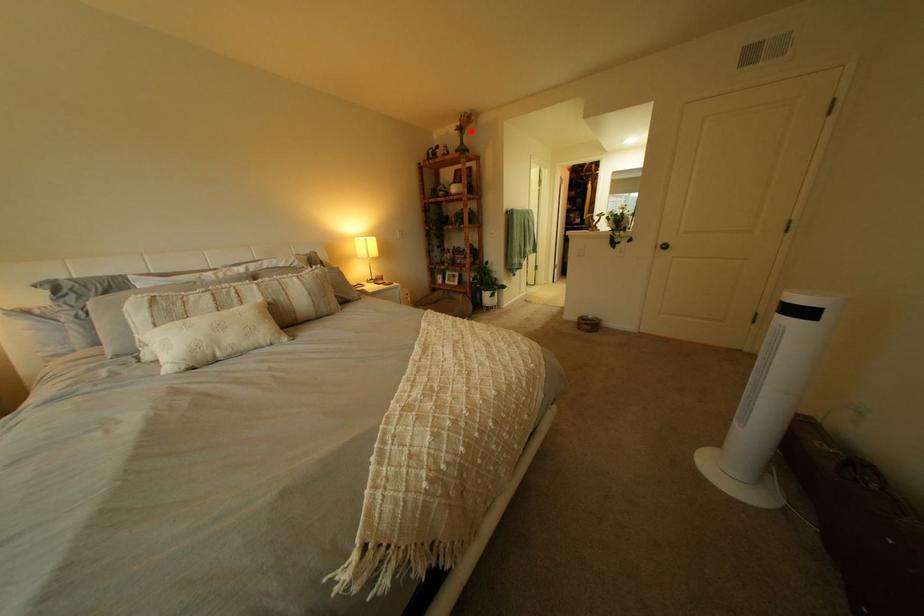
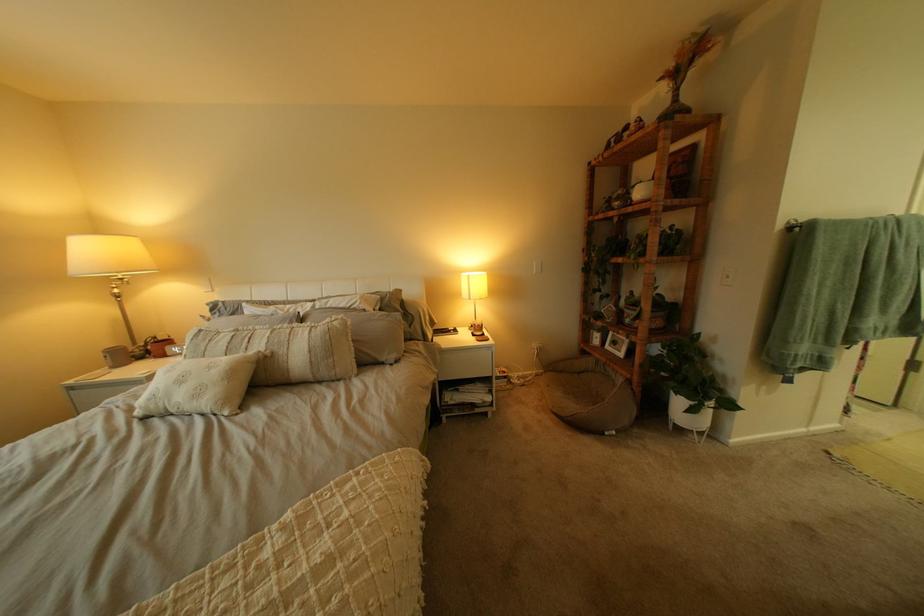
Where in the second image is the point corresponding to the highlighted location from the first image?

(675, 81)